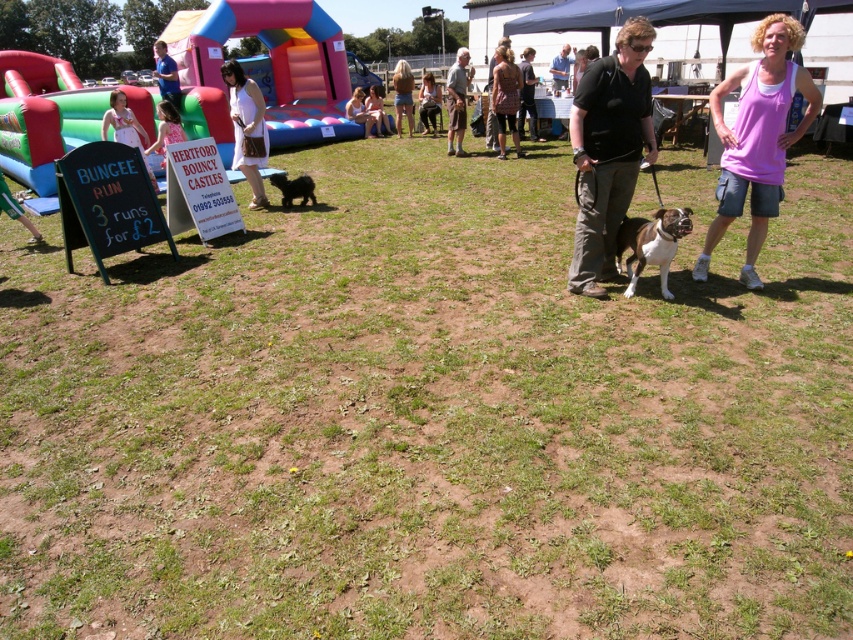
You are standing at the edge of the grassy field and see both the dark brown leather jacket at center and the blue shirt at upper left. Which person is closer to you?

The dark brown leather jacket at center is closer to you because it is further to the viewer than the blue shirt at upper left.

You are at an outdoor event and see a dark brown leather jacket at center and a blue shirt at upper left. Which one is positioned more to the right?

The dark brown leather jacket at center is positioned more to the right than the blue shirt at upper left.